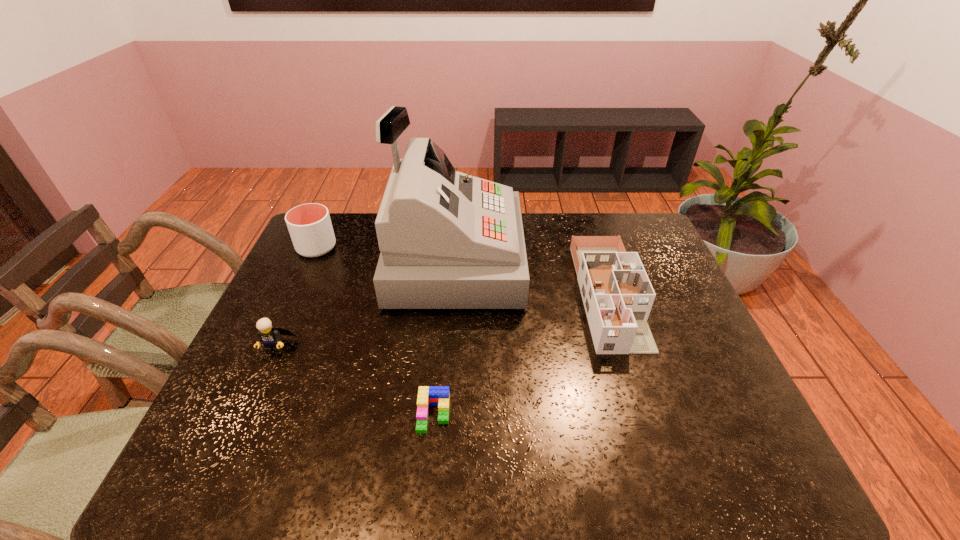
This screenshot has width=960, height=540. What are the coordinates of `vacant space situated 0.150m at the entrance of the rightmost object` in the screenshot? It's located at (644, 406).

Where is `free space located on the right of the shortest object`? The height and width of the screenshot is (540, 960). free space located on the right of the shortest object is located at coordinates (476, 415).

Where is `cash register present at the far edge`? The height and width of the screenshot is (540, 960). cash register present at the far edge is located at coordinates (448, 240).

At what (x,y) coordinates should I click in order to perform the action: click on cup at the far edge. Please return your answer as a coordinate pair (x, y). Looking at the image, I should click on (310, 227).

The height and width of the screenshot is (540, 960). In order to click on dollhouse situated at the far edge in this screenshot , I will do `click(617, 294)`.

Where is `cup that is positioned at the left edge`? cup that is positioned at the left edge is located at coordinates (310, 227).

Find the location of `Lego that is at the left edge`. Lego that is at the left edge is located at coordinates (270, 337).

What are the coordinates of `object that is at the right edge` in the screenshot? It's located at coord(617,294).

Where is `object that is at the far left corner`? This screenshot has width=960, height=540. object that is at the far left corner is located at coordinates (310, 227).

At what (x,y) coordinates should I click in order to perform the action: click on object located in the far right corner section of the desktop. Please return your answer as a coordinate pair (x, y). Looking at the image, I should click on (617, 294).